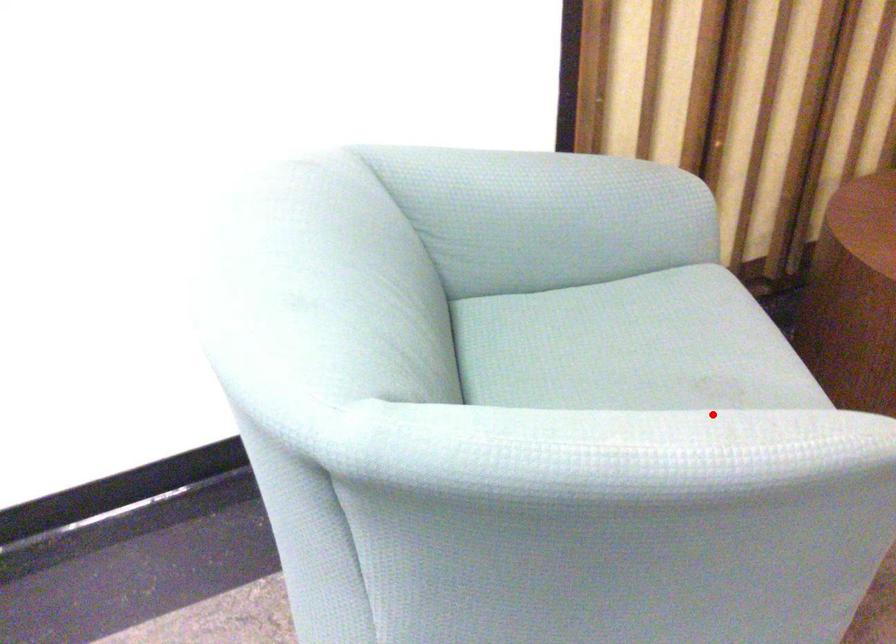
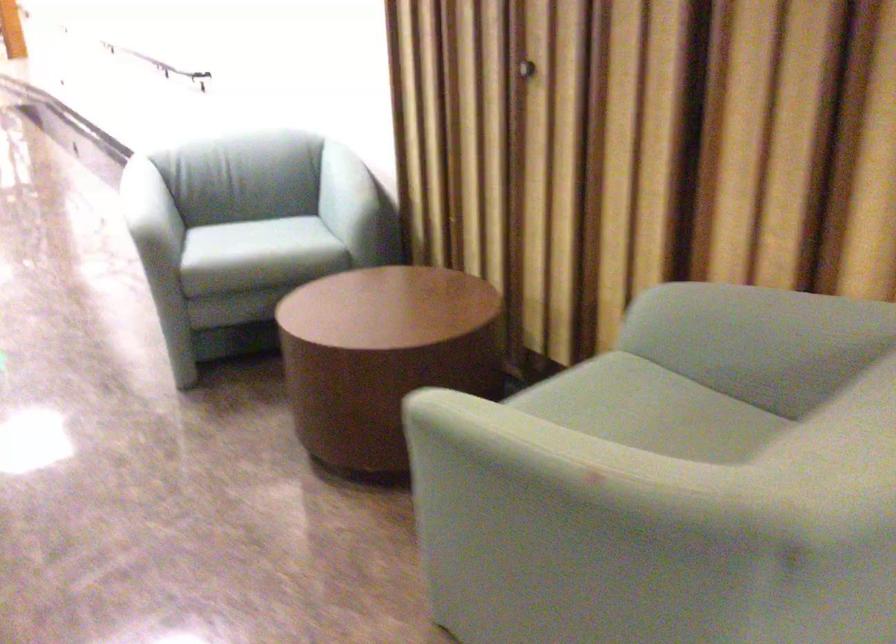
Question: I am providing you with two images of the same scene from different viewpoints. Image1 has a red point marked. In image2, the corresponding 3D location appears at what relative position? Reply with the corresponding letter.

Choices:
 (A) Closer
 (B) Farther

Answer: (B)